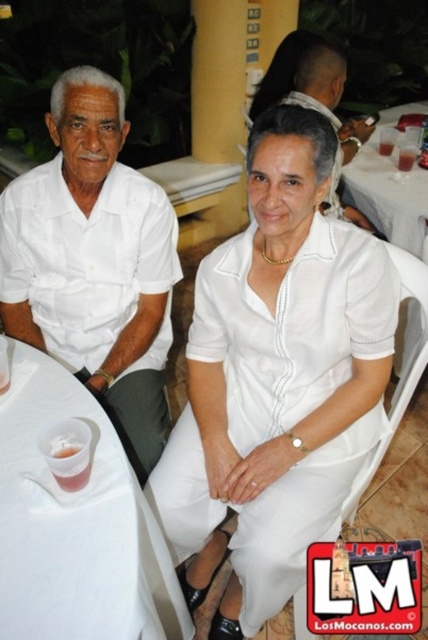
Does white satin dress at center have a lesser width compared to translucent plastic cup at lower left?

Incorrect, white satin dress at center's width is not less than translucent plastic cup at lower left's.

Who is positioned more to the left, white satin dress at center or translucent plastic cup at lower left?

translucent plastic cup at lower left is more to the left.

Image resolution: width=428 pixels, height=640 pixels. What do you see at coordinates (276, 376) in the screenshot?
I see `white satin dress at center` at bounding box center [276, 376].

I want to click on white satin dress at center, so click(x=276, y=376).

Who is positioned more to the right, matte white shirt at left or white fabric chair at center?

white fabric chair at center is more to the right.

Which is in front, point (124, 248) or point (389, 252)?

Point (389, 252) is more forward.

Find the location of a particular element. The image size is (428, 640). matte white shirt at left is located at coordinates (94, 262).

Is white satin dress at center below white fabric chair at center?

Incorrect, white satin dress at center is not positioned below white fabric chair at center.

Is point (383, 259) more distant than point (374, 454)?

No, it is not.

Image resolution: width=428 pixels, height=640 pixels. Identify the location of white satin dress at center. (276, 376).